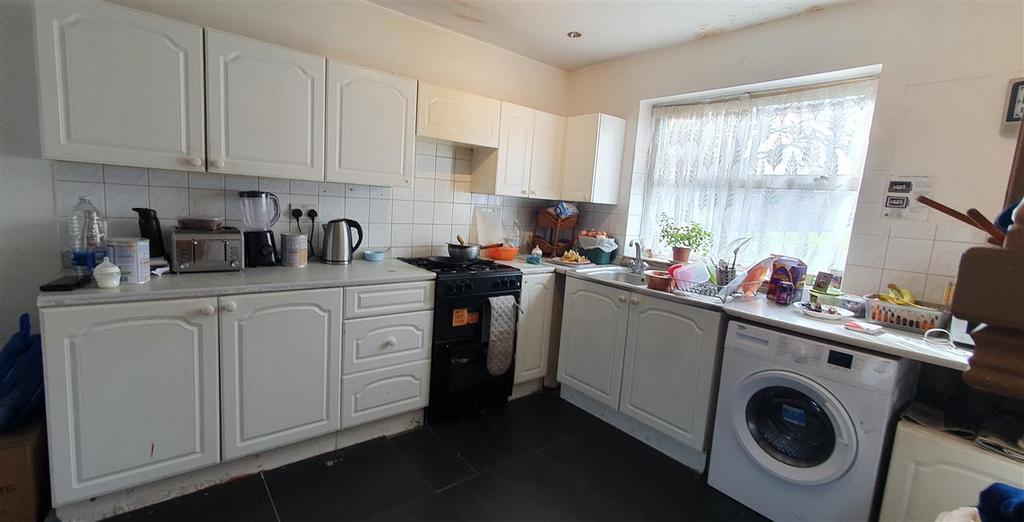
Where is `floor`? floor is located at coordinates [x=490, y=477].